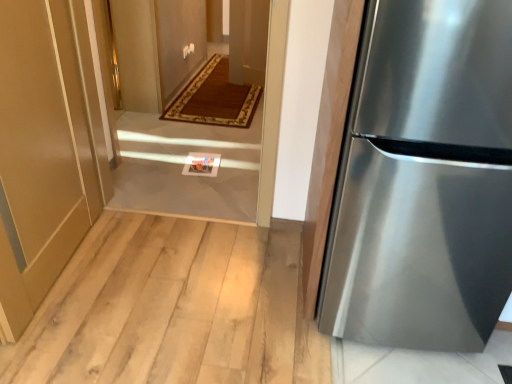
The width and height of the screenshot is (512, 384). What are the coordinates of `free space that is in between matte gold door at lower left and stainless steel refrigerator at right` in the screenshot? It's located at (185, 284).